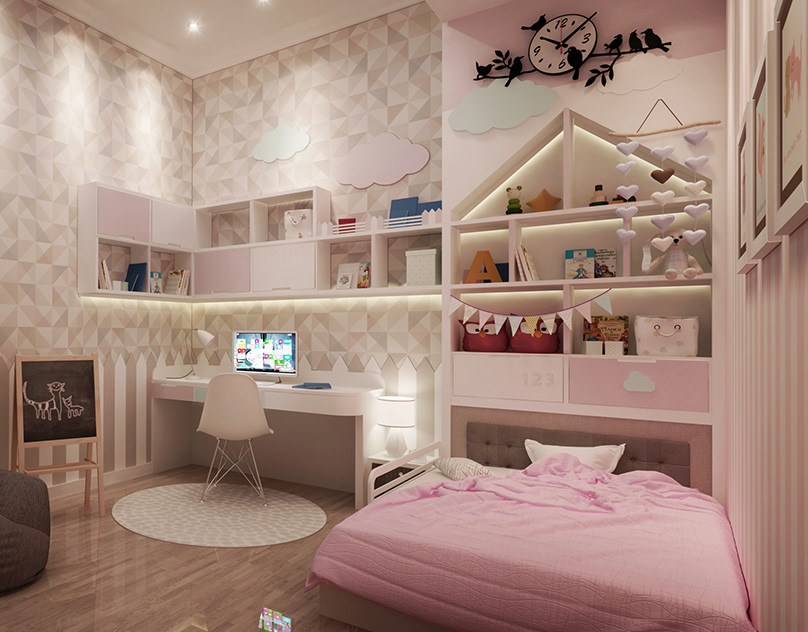
The height and width of the screenshot is (632, 808). In order to click on pink comforter in this screenshot , I will do `click(549, 557)`.